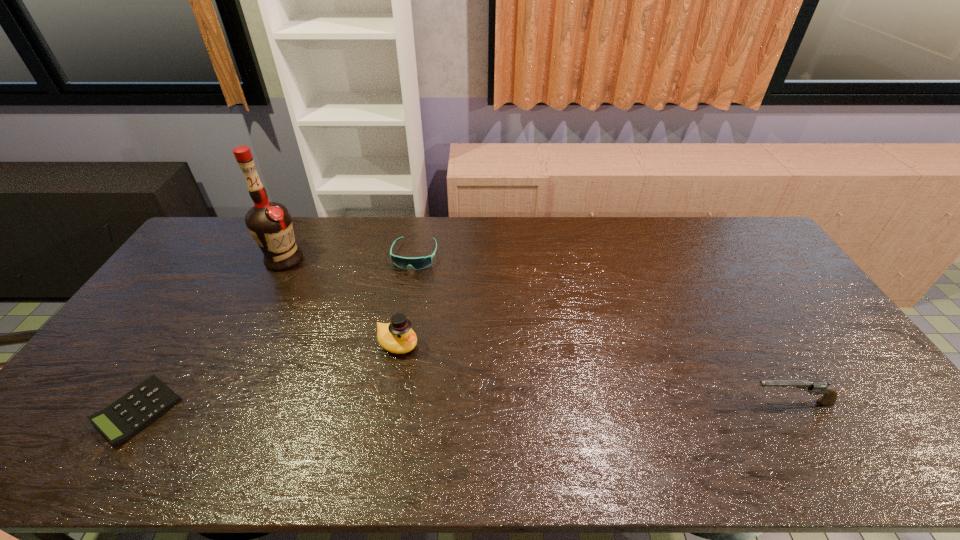
Identify the location of free space at the far edge. This screenshot has height=540, width=960. (396, 223).

This screenshot has width=960, height=540. What are the coordinates of `vacant space at the near edge of the desktop` in the screenshot? It's located at (237, 396).

The image size is (960, 540). In the image, there is a desktop. Find the location of `vacant space at the left edge`. vacant space at the left edge is located at coordinates 223,264.

This screenshot has width=960, height=540. In the image, there is a desktop. Find the location of `blank space at the right edge`. blank space at the right edge is located at coordinates (816, 374).

This screenshot has width=960, height=540. In order to click on free space at the far right corner in this screenshot , I will do (x=711, y=218).

In the image, there is a desktop. Where is `vacant space at the near right corner`? This screenshot has width=960, height=540. vacant space at the near right corner is located at coordinates (878, 414).

You are a GUI agent. You are given a task and a screenshot of the screen. Output one action in this format:
    pyautogui.click(x=<x>, y=<y>)
    Task: Click on the free space between the sunglasses and the third shortest object
    Image resolution: width=960 pixels, height=540 pixels.
    Given the screenshot: What is the action you would take?
    pos(603,329)

I want to click on unoccupied position between the gun and the fourth shortest object, so tap(594, 373).

You are a GUI agent. You are given a task and a screenshot of the screen. Output one action in this format:
    pyautogui.click(x=<x>, y=<y>)
    Task: Click on the free space between the sunglasses and the leftmost object
    
    Given the screenshot: What is the action you would take?
    pyautogui.click(x=276, y=333)

The height and width of the screenshot is (540, 960). What are the coordinates of `vacant region between the second tallest object and the gun` in the screenshot? It's located at (594, 373).